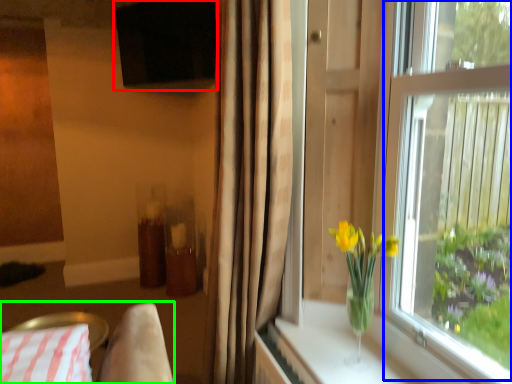
Question: Considering the real-world distances, which object is farthest from window screen (highlighted by a red box)? window screen (highlighted by a blue box) or bedding (highlighted by a green box)?

Choices:
 (A) window screen
 (B) bedding

Answer: (B)